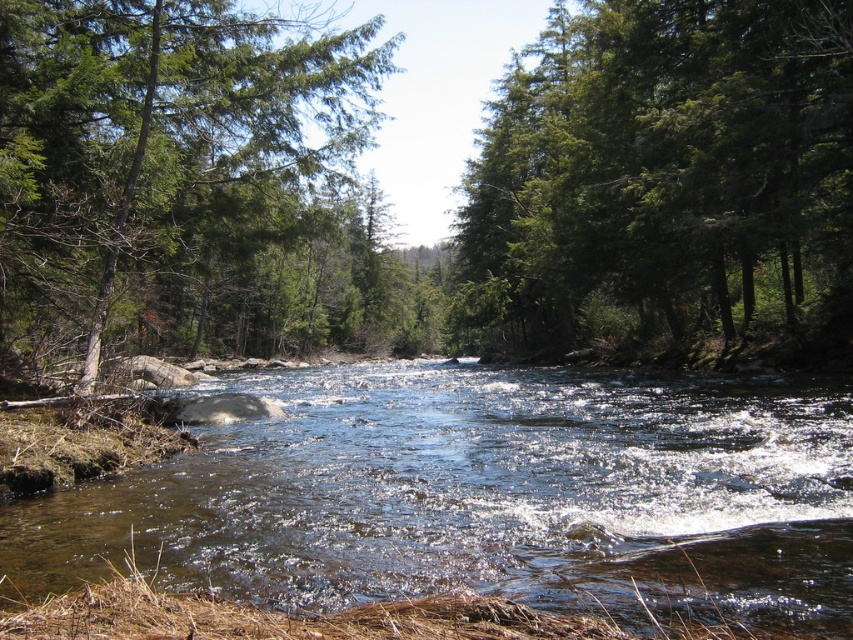
Question: Estimate the real-world distances between objects in this image. Which object is farther from the green leafy forest at center?

Choices:
 (A) green matte tree at upper right
 (B) green matte tree at left

Answer: (A)

Question: Where is green leafy forest at center located in relation to green matte tree at upper right in the image?

Choices:
 (A) left
 (B) right

Answer: (A)

Question: Which object appears farthest from the camera in this image?

Choices:
 (A) clear water at center
 (B) green leafy forest at center

Answer: (B)

Question: Can you confirm if green matte tree at left is wider than green matte tree at upper right?

Choices:
 (A) yes
 (B) no

Answer: (A)

Question: Which point appears farthest from the camera in this image?

Choices:
 (A) (850, 593)
 (B) (473, 182)
 (C) (100, 170)
 (D) (134, 324)

Answer: (B)

Question: Is green leafy forest at center above clear water at center?

Choices:
 (A) yes
 (B) no

Answer: (A)